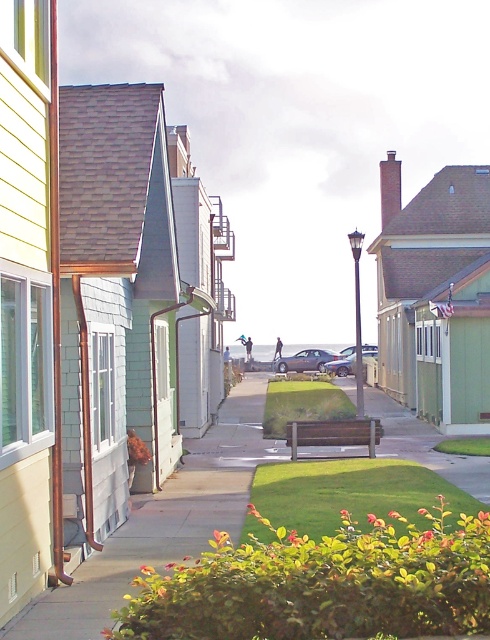
Question: Which object appears farthest from the camera in this image?

Choices:
 (A) concrete sidewalk at center
 (B) metallic silver sedan at center

Answer: (B)

Question: Which point is farther to the camera?

Choices:
 (A) (294, 355)
 (B) (373, 353)
 (C) (155, 545)

Answer: (A)

Question: Which object is farther from the camera taking this photo?

Choices:
 (A) satin silver sedan at center
 (B) concrete sidewalk at center
 (C) metallic silver sedan at center

Answer: (A)

Question: Is concrete sidewalk at center positioned before satin silver sedan at center?

Choices:
 (A) yes
 (B) no

Answer: (A)

Question: Is concrete sidewalk at center above metallic silver sedan at center?

Choices:
 (A) yes
 (B) no

Answer: (B)

Question: In this image, where is satin silver sedan at center located relative to metallic silver sedan at center?

Choices:
 (A) below
 (B) above

Answer: (B)